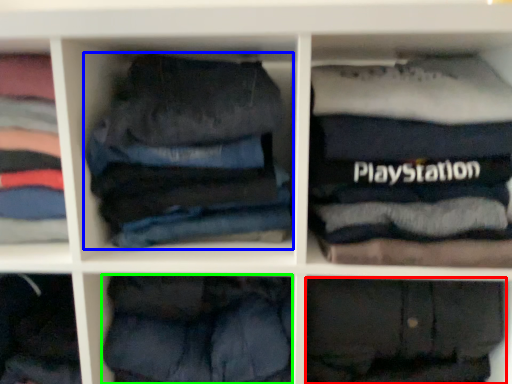
Question: Based on their relative distances, which object is farther from trousers (highlighted by a red box)? Choose from trousers (highlighted by a blue box) and trousers (highlighted by a green box).

Choices:
 (A) trousers
 (B) trousers

Answer: (A)